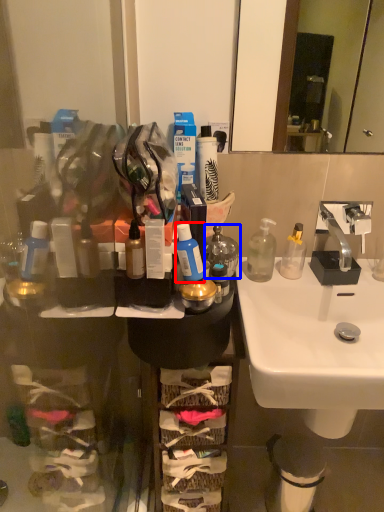
Question: Which point is closer to the camera, mouthwash (highlighted by a red box) or bottle (highlighted by a blue box)?

Choices:
 (A) mouthwash
 (B) bottle

Answer: (A)